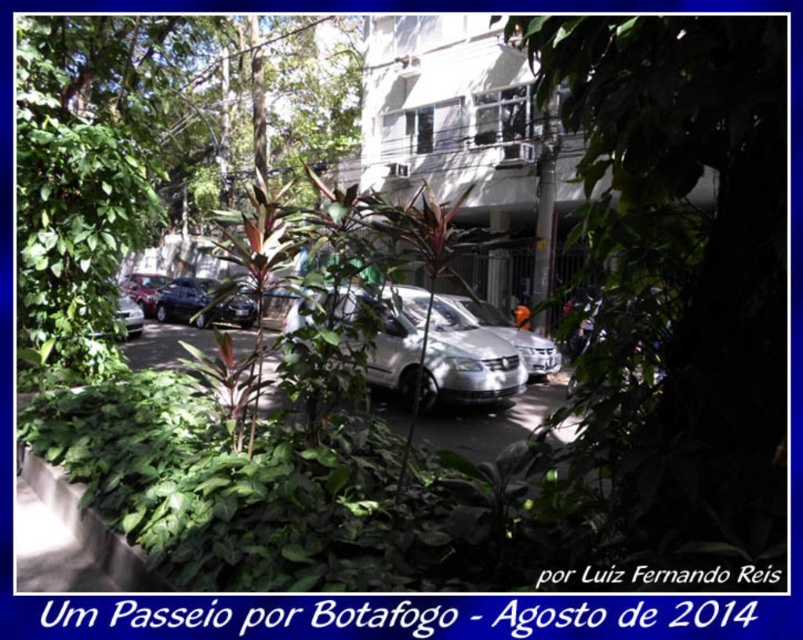
Question: Which object is the closest to the satin silver car at center?

Choices:
 (A) shiny metallic car at center
 (B) green leafy tree at center
 (C) satin metallic car at center
 (D) silver metallic car at center

Answer: (A)

Question: Based on their relative distances, which object is nearer to the shiny metallic car at center?

Choices:
 (A) green leafy tree at center
 (B) satin black car at center
 (C) silver metallic car at center

Answer: (B)

Question: Does green leafy tree at center appear under green leafy plant at center?

Choices:
 (A) no
 (B) yes

Answer: (B)

Question: Considering the real-world distances, which object is farthest from the satin black car at center?

Choices:
 (A) silver metallic car at center
 (B) satin silver car at center

Answer: (A)

Question: Considering the relative positions of green leafy plant at center and satin black car at center in the image provided, where is green leafy plant at center located with respect to satin black car at center?

Choices:
 (A) below
 (B) above

Answer: (B)

Question: Is satin black car at center to the left of shiny metallic car at center from the viewer's perspective?

Choices:
 (A) no
 (B) yes

Answer: (A)